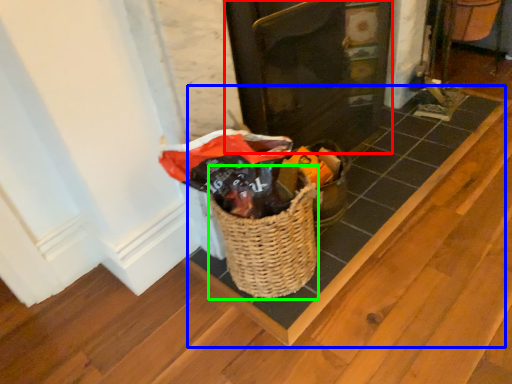
Question: Based on their relative distances, which object is nearer to door (highlighted by a red box)? Choose from plank (highlighted by a blue box) and basket (highlighted by a green box).

Choices:
 (A) plank
 (B) basket

Answer: (A)